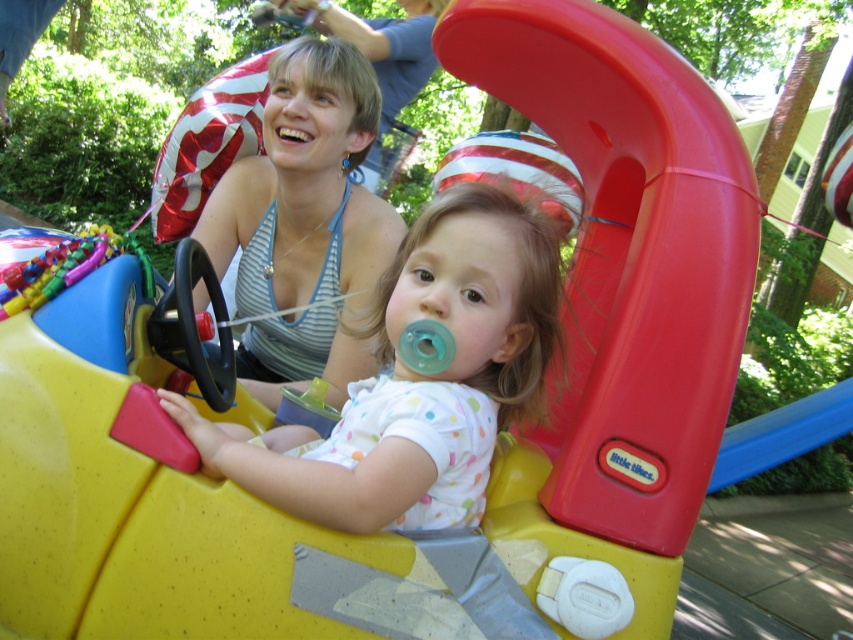
Who is more distant from viewer, [469,492] or [310,211]?

Point [310,211]

What do you see at coordinates (421, 380) in the screenshot? I see `white dotted fabric at center` at bounding box center [421, 380].

The width and height of the screenshot is (853, 640). Identify the location of white dotted fabric at center. (421, 380).